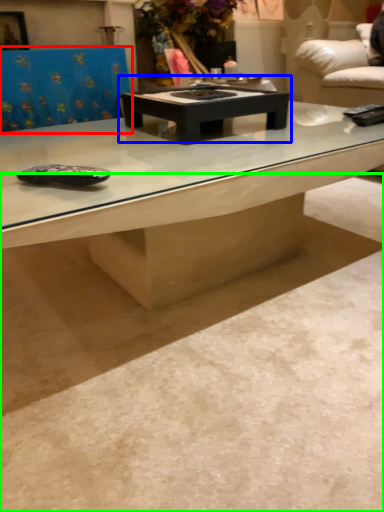
Question: Which object is positioned farthest from swivel chair (highlighted by a red box)? Select from coffee table (highlighted by a blue box) and concrete (highlighted by a green box).

Choices:
 (A) coffee table
 (B) concrete

Answer: (B)